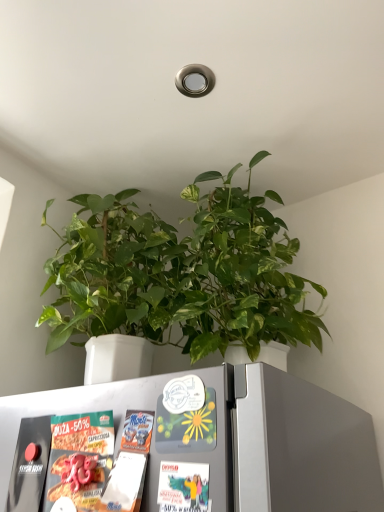
Question: Does point (89, 246) appear closer or farther from the camera than point (244, 398)?

Choices:
 (A) farther
 (B) closer

Answer: (A)

Question: Considering their positions, is green matte plant at center located in front of or behind white matte refrigerator at lower center?

Choices:
 (A) behind
 (B) front

Answer: (A)

Question: Is green matte plant at center taller or shorter than white matte refrigerator at lower center?

Choices:
 (A) short
 (B) tall

Answer: (B)

Question: Is point (331, 413) closer or farther from the camera than point (278, 337)?

Choices:
 (A) farther
 (B) closer

Answer: (B)

Question: From a real-world perspective, is white matte refrigerator at lower center physically located above or below green matte plant at center?

Choices:
 (A) above
 (B) below

Answer: (B)

Question: Choose the correct answer: Is white matte refrigerator at lower center inside green matte plant at center or outside it?

Choices:
 (A) inside
 (B) outside

Answer: (B)

Question: Considering the relative positions of white matte refrigerator at lower center and green matte plant at center in the image provided, is white matte refrigerator at lower center to the left or to the right of green matte plant at center?

Choices:
 (A) left
 (B) right

Answer: (A)